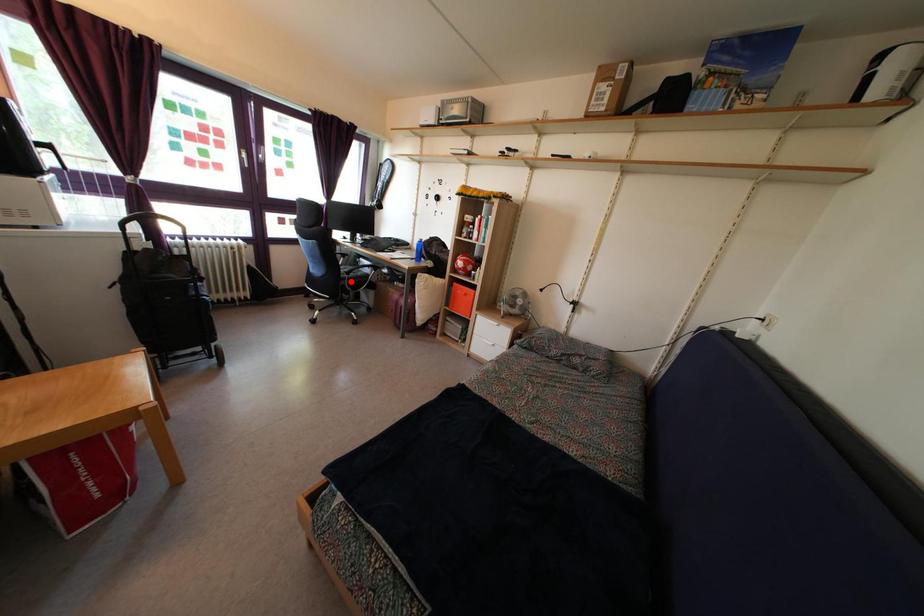
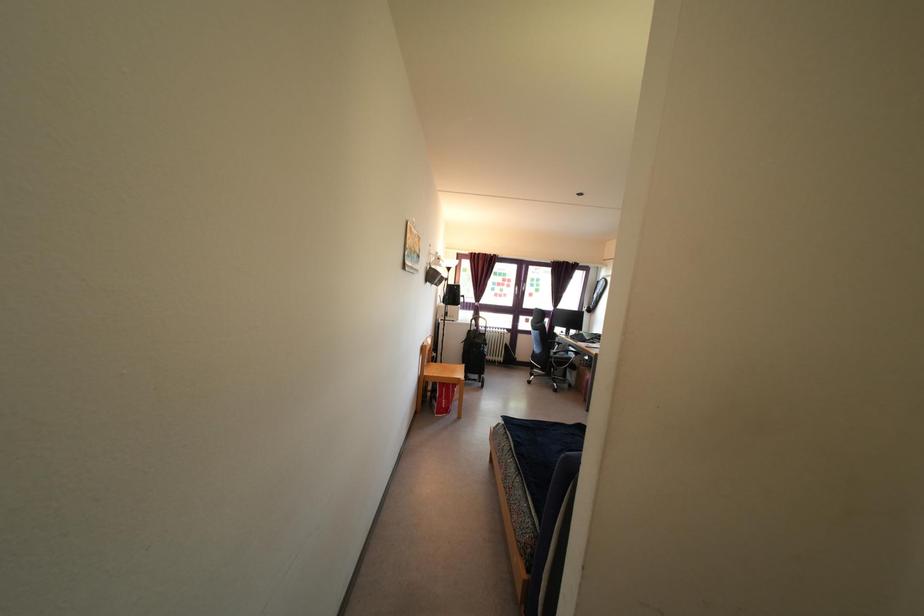
Locate, in the second image, the point that corresponds to the highlighted location in the first image.

(557, 362)